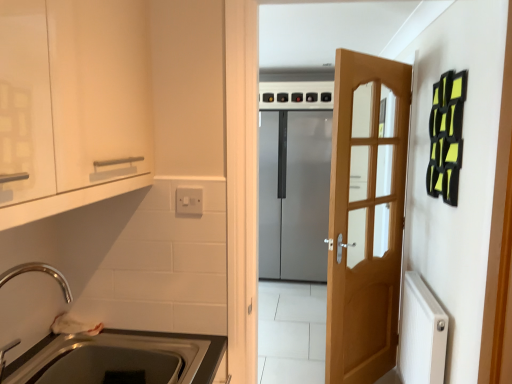
Question: From their relative heights in the image, would you say metallic stainless steel sink at lower left is taller or shorter than white plastic switch at upper center?

Choices:
 (A) tall
 (B) short

Answer: (A)

Question: Is point (198, 372) positioned closer to the camera than point (187, 198)?

Choices:
 (A) closer
 (B) farther

Answer: (B)

Question: Based on their relative distances, which object is farther from the satin silver refrigerator at center?

Choices:
 (A) metallic stainless steel sink at lower left
 (B) chrome metallic faucet at lower left
 (C) white plastic switch at upper center
 (D) black plastic knob at upper center, the third knob from the left
 (E) white glossy cabinet at upper left

Answer: (E)

Question: Which is farther from the satin silver refrigerator at center?

Choices:
 (A) wooden door at center
 (B) white plastic switch at upper center
 (C) white glossy cabinet at upper left
 (D) black plastic knob at upper center, the third knob from the left
 (E) black plastic knob at upper center, which ranks as the third knob in right-to-left order

Answer: (C)